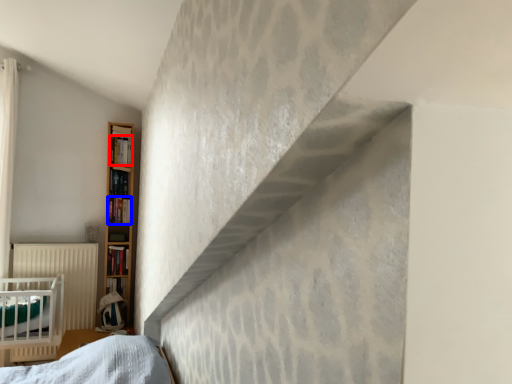
Question: Which object is further to the camera taking this photo, book (highlighted by a red box) or book (highlighted by a blue box)?

Choices:
 (A) book
 (B) book

Answer: (B)